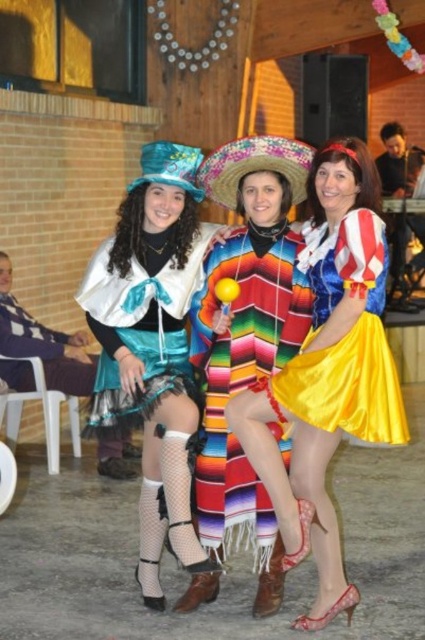
Is point (342, 220) positioned after point (158, 353)?

No, (342, 220) is in front of (158, 353).

Between yellow satin skirt at center and shiny teal cape at center, which one appears on the left side from the viewer's perspective?

shiny teal cape at center is more to the left.

Is point (345, 236) positioned in front of point (96, 284)?

Yes, it is in front of point (96, 284).

You are a GUI agent. You are given a task and a screenshot of the screen. Output one action in this format:
    pyautogui.click(x=<x>, y=<y>)
    Task: Click on the yellow satin skirt at center
    
    Given the screenshot: What is the action you would take?
    pyautogui.click(x=346, y=339)

What do you see at coordinates (153, 344) in the screenshot? I see `shiny teal fabric dress at left` at bounding box center [153, 344].

The image size is (425, 640). Identify the location of shiny teal fabric dress at left. [x=153, y=344].

Who is more distant from viewer, (146, 353) or (405, 428)?

Point (146, 353)

I want to click on shiny teal fabric dress at left, so click(153, 344).

Is shiny teal fabric dress at left bigger than shiny teal cape at center?

Indeed, shiny teal fabric dress at left has a larger size compared to shiny teal cape at center.

Where is `shiny teal fabric dress at left`? The image size is (425, 640). shiny teal fabric dress at left is located at coordinates (153, 344).